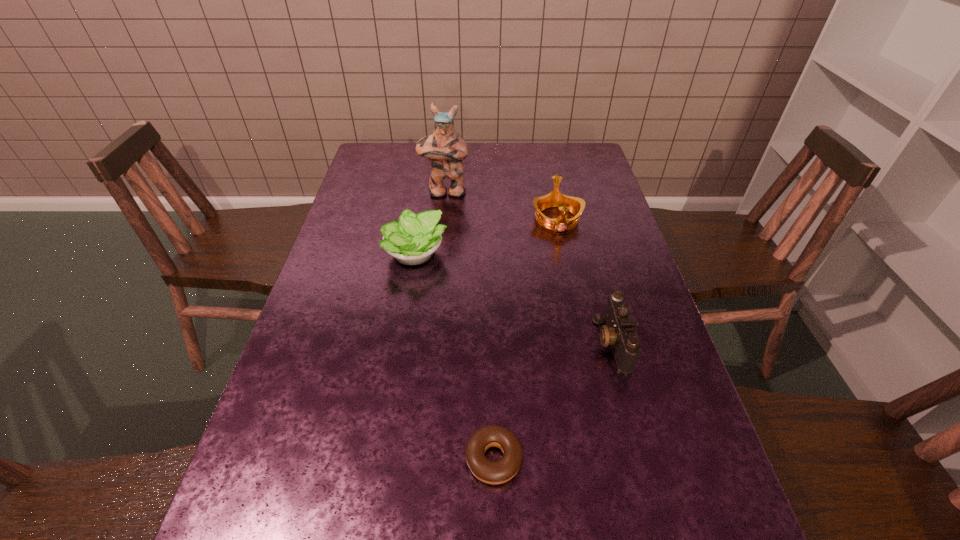
Find the location of `the farthest object`. the farthest object is located at coordinates (445, 148).

You are a GUI agent. You are given a task and a screenshot of the screen. Output one action in this format:
    pyautogui.click(x=<x>, y=<y>)
    Task: Click on the figurine
    The height and width of the screenshot is (540, 960).
    Given the screenshot: What is the action you would take?
    pos(445,148)

Identify the location of tiara. (555, 198).

In order to click on lettuce in this screenshot , I will do `click(412, 240)`.

The height and width of the screenshot is (540, 960). In order to click on the fourth farthest object in this screenshot , I will do `click(619, 332)`.

Locate an element on the screen. Image resolution: width=960 pixels, height=540 pixels. doughnut is located at coordinates (500, 471).

The height and width of the screenshot is (540, 960). I want to click on the shortest object, so click(x=500, y=471).

What are the coordinates of `vacant area located 0.350m on the front-facing side of the figurine` in the screenshot? It's located at (437, 274).

Find the location of `vacant area located 0.290m at the front emblem of the tiara`. vacant area located 0.290m at the front emblem of the tiara is located at coordinates (577, 314).

I want to click on blank space located on the front of the lettuce, so click(410, 293).